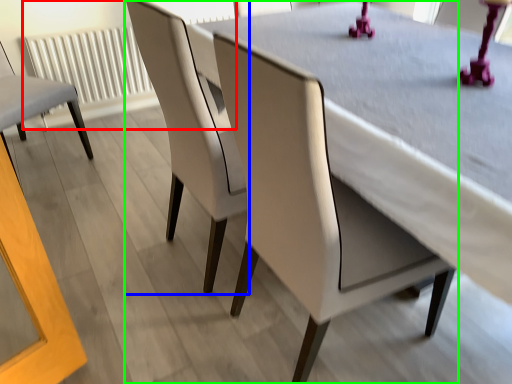
Question: Which object is the farthest from radiator (highlighted by a red box)? Choose among these: chair (highlighted by a blue box) or chair (highlighted by a green box).

Choices:
 (A) chair
 (B) chair

Answer: (B)